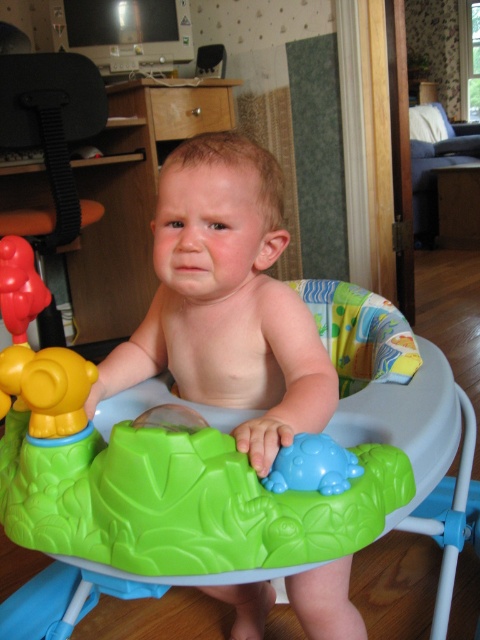
You are a parent trying to move your child from the black plastic feeding chair at left to the velvet blue couch at upper right. Considering the distance between them, can you carry your child directly without needing to navigate around any obstacles?

The black plastic feeding chair at left and velvet blue couch at upper right are 3.16 meters apart, so yes, you can carry your child directly between them without needing to navigate around obstacles since the distance is straightforward.

You are a parent trying to move your child from the blue rubber turtle at center to the black plastic feeding chair at left. Which object should you approach first to reach the feeding chair?

You should approach the blue rubber turtle at center first because the black plastic feeding chair at left is further away from you, so you need to go past the blue rubber turtle at center to reach it.

You are a parent trying to move your child from the blue rubber turtle at center to the black plastic feeding chair at left. Which direction should you move the baby walker to reach the feeding chair?

You should move the baby walker to the left because the black plastic feeding chair at left is located to the left of the blue rubber turtle at center.